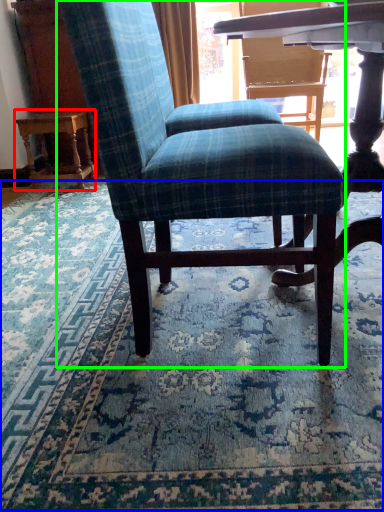
Question: Considering the real-world distances, which object is farthest from table (highlighted by a red box)? mat (highlighted by a blue box) or chair (highlighted by a green box)?

Choices:
 (A) mat
 (B) chair

Answer: (B)